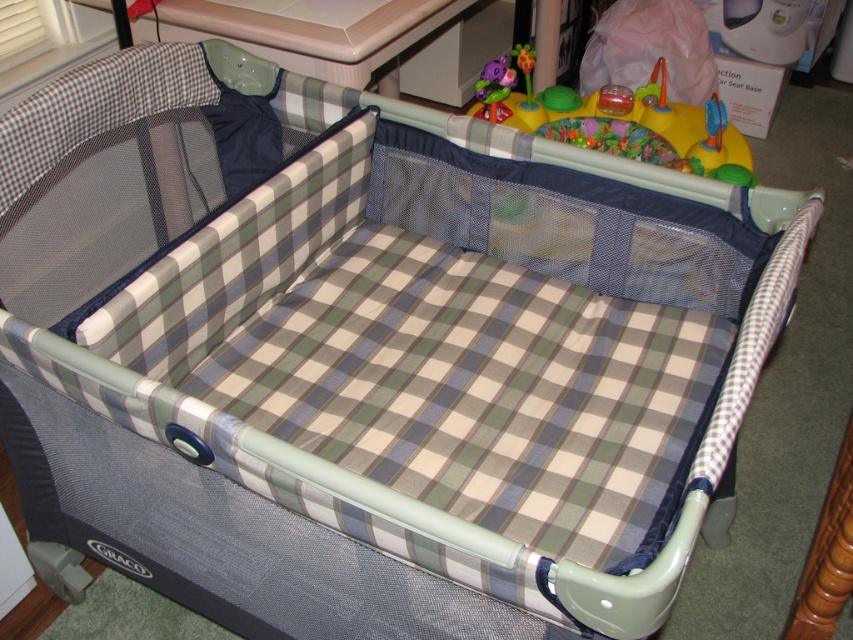
Can you confirm if rubberized plastic play gym at upper center is bigger than plush purple elephant at upper center?

Yes, rubberized plastic play gym at upper center is bigger than plush purple elephant at upper center.

At what (x,y) coordinates should I click in order to perform the action: click on rubberized plastic play gym at upper center. Please return your answer as a coordinate pair (x, y). This screenshot has height=640, width=853. Looking at the image, I should click on (624, 124).

Find the location of a particular element. This screenshot has height=640, width=853. rubberized plastic play gym at upper center is located at coordinates (624, 124).

Does white glossy changing table at upper center come in front of plush purple elephant at upper center?

Yes, it is.

Looking at this image, can you confirm if white glossy changing table at upper center is positioned above plush purple elephant at upper center?

No, white glossy changing table at upper center is not above plush purple elephant at upper center.

The image size is (853, 640). What do you see at coordinates (357, 36) in the screenshot?
I see `white glossy changing table at upper center` at bounding box center [357, 36].

Locate an element on the screen. The width and height of the screenshot is (853, 640). white glossy changing table at upper center is located at coordinates (357, 36).

Between white glossy changing table at upper center and rubberized plastic play gym at upper center, which one is positioned higher?

white glossy changing table at upper center is above.

Which is more to the left, white glossy changing table at upper center or rubberized plastic play gym at upper center?

Positioned to the left is white glossy changing table at upper center.

Which is behind, point (457, 72) or point (701, 154)?

Point (457, 72)

Identify the location of white glossy changing table at upper center. Image resolution: width=853 pixels, height=640 pixels. (357, 36).